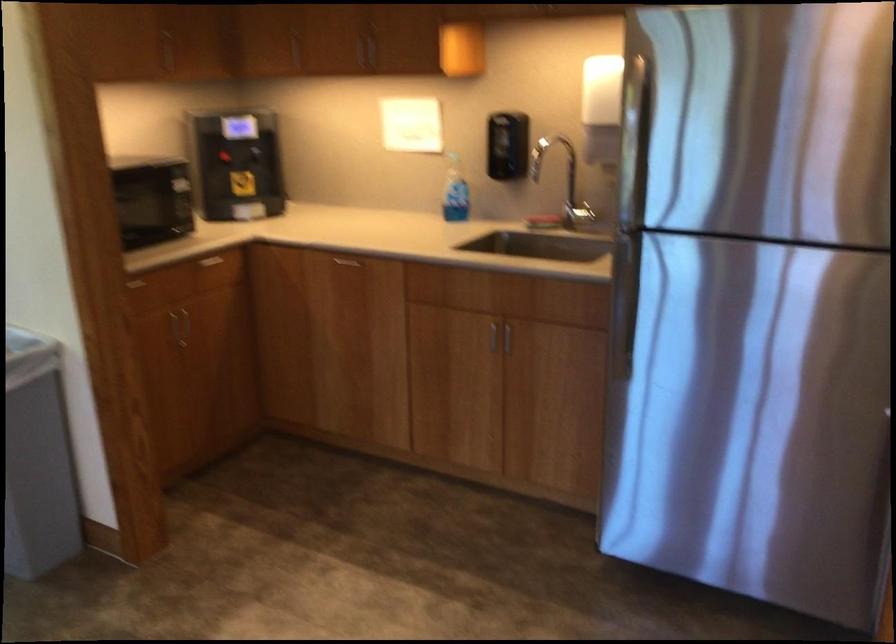
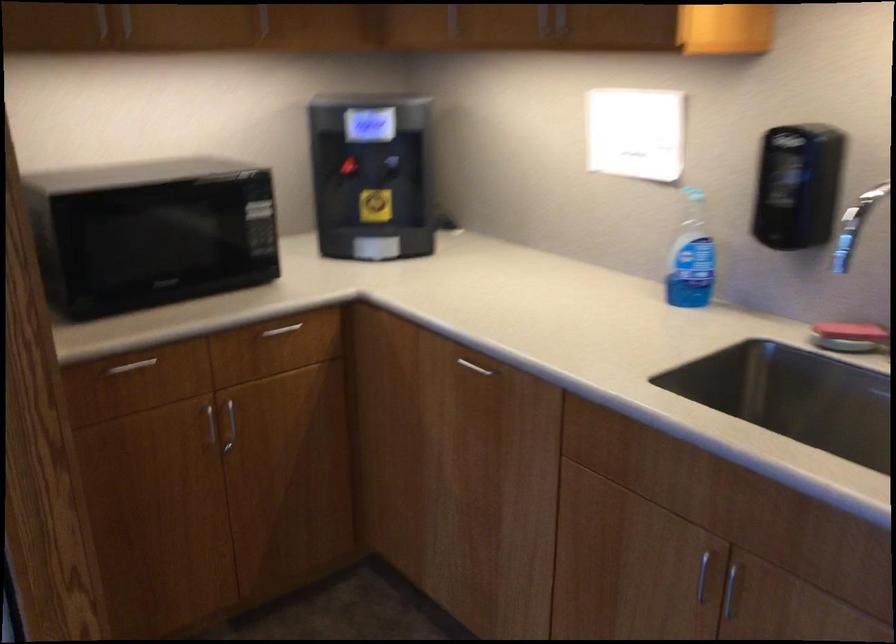
In the second image, find the point that corresponds to point 492,339 in the first image.

(702, 574)